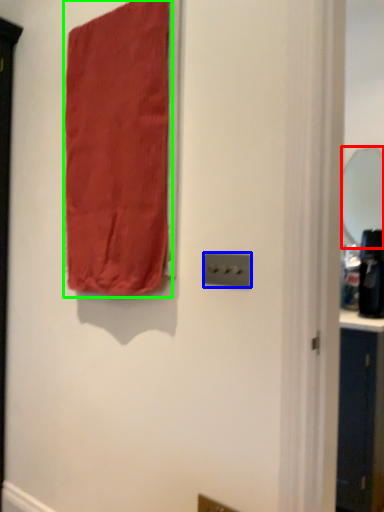
Question: Which is farther away from mirror (highlighted by a red box)? light switch (highlighted by a blue box) or curtain (highlighted by a green box)?

Choices:
 (A) light switch
 (B) curtain

Answer: (A)